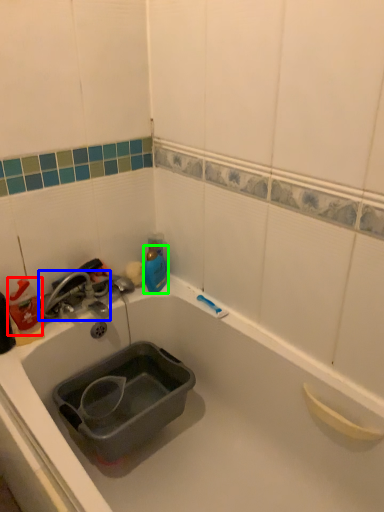
Question: Which object is positioned closest to cleaning product (highlighted by a red box)? Select from tap (highlighted by a blue box) and bottle (highlighted by a green box).

Choices:
 (A) tap
 (B) bottle

Answer: (A)